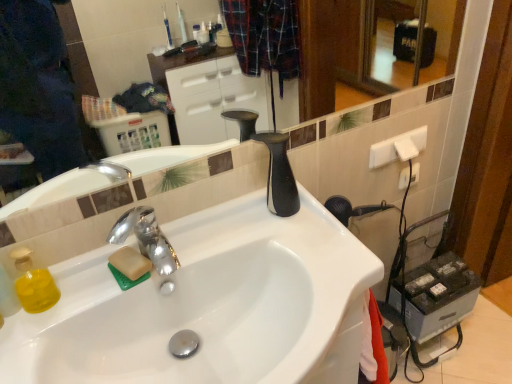
Question: From the image's perspective, is white plastic electric outlet at upper right over chrome metallic faucet at center?

Choices:
 (A) yes
 (B) no

Answer: (A)

Question: Is white plastic electric outlet at upper right at the left side of chrome metallic faucet at center?

Choices:
 (A) no
 (B) yes

Answer: (A)

Question: Is white plastic electric outlet at upper right shorter than chrome metallic faucet at center?

Choices:
 (A) no
 (B) yes

Answer: (B)

Question: Does white plastic electric outlet at upper right turn towards chrome metallic faucet at center?

Choices:
 (A) yes
 (B) no

Answer: (B)

Question: Considering the relative sizes of white plastic electric outlet at upper right and chrome metallic faucet at center in the image provided, is white plastic electric outlet at upper right bigger than chrome metallic faucet at center?

Choices:
 (A) no
 (B) yes

Answer: (A)

Question: From a real-world perspective, is white plastic electric outlet at upper right located higher than chrome metallic faucet at center?

Choices:
 (A) yes
 (B) no

Answer: (B)

Question: Is white glossy sink at center closer to the viewer compared to glossy ceramic mirror at upper center?

Choices:
 (A) no
 (B) yes

Answer: (A)

Question: Is white glossy sink at center facing away from glossy ceramic mirror at upper center?

Choices:
 (A) no
 (B) yes

Answer: (A)

Question: Is white glossy sink at center smaller than glossy ceramic mirror at upper center?

Choices:
 (A) yes
 (B) no

Answer: (B)

Question: Is white glossy sink at center positioned behind glossy ceramic mirror at upper center?

Choices:
 (A) yes
 (B) no

Answer: (A)

Question: Considering the relative sizes of white glossy sink at center and glossy ceramic mirror at upper center in the image provided, is white glossy sink at center bigger than glossy ceramic mirror at upper center?

Choices:
 (A) yes
 (B) no

Answer: (A)

Question: From the image's perspective, would you say white glossy sink at center is positioned over glossy ceramic mirror at upper center?

Choices:
 (A) yes
 (B) no

Answer: (B)

Question: Is chrome metallic faucet at center far from white plastic electric outlet at upper right?

Choices:
 (A) no
 (B) yes

Answer: (A)